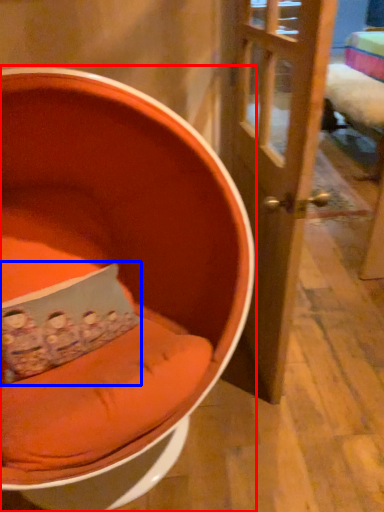
Question: Which object appears closest to the camera in this image, chair (highlighted by a red box) or pillow (highlighted by a blue box)?

Choices:
 (A) chair
 (B) pillow

Answer: (A)